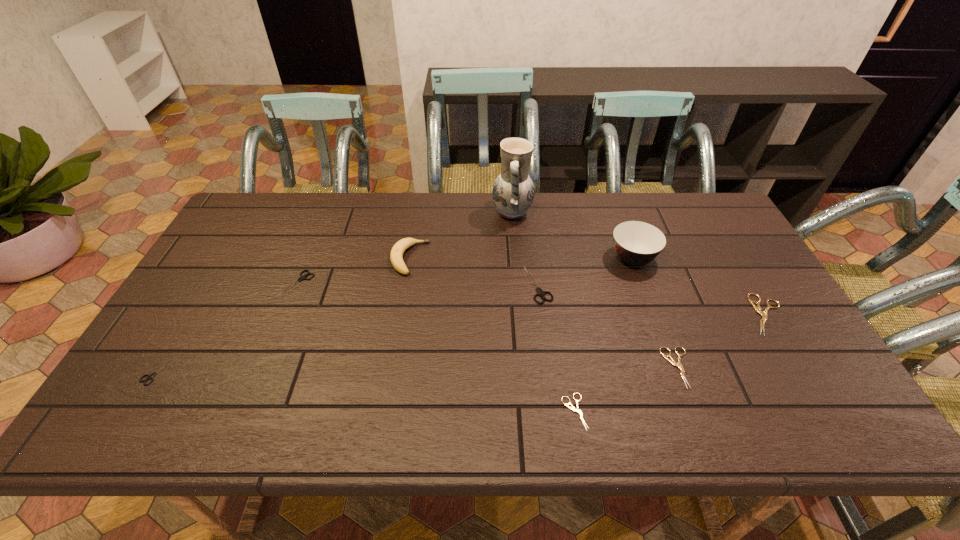
Find the location of a particular element. Image resolution: width=960 pixels, height=540 pixels. object at the left edge is located at coordinates (150, 377).

Identify the location of object at the right edge. Image resolution: width=960 pixels, height=540 pixels. (764, 315).

Where is `vacant space at the far edge of the desktop`? vacant space at the far edge of the desktop is located at coordinates (427, 194).

The image size is (960, 540). Find the location of `vacant region at the near edge of the desktop`. vacant region at the near edge of the desktop is located at coordinates (612, 404).

This screenshot has width=960, height=540. In the image, there is a desktop. Find the location of `vacant space at the left edge`. vacant space at the left edge is located at coordinates (231, 246).

In the image, there is a desktop. Identify the location of vacant space at the right edge. This screenshot has height=540, width=960. (756, 334).

Find the location of a particular element. This screenshot has width=960, height=540. vacant space at the far left corner of the desktop is located at coordinates (258, 228).

Locate an element on the screen. The image size is (960, 540). vacant area between the rightmost object and the third tallest object is located at coordinates (588, 287).

You are a GUI agent. You are given a task and a screenshot of the screen. Output one action in this format:
    pyautogui.click(x=<x>, y=<y>)
    Task: Click on the free space between the nearest shears and the rightmost object
    This screenshot has width=960, height=540.
    Given the screenshot: What is the action you would take?
    pyautogui.click(x=670, y=363)

Find the location of a particular element. vacant area that lies between the farthest beige shears and the banana is located at coordinates pyautogui.click(x=588, y=287).